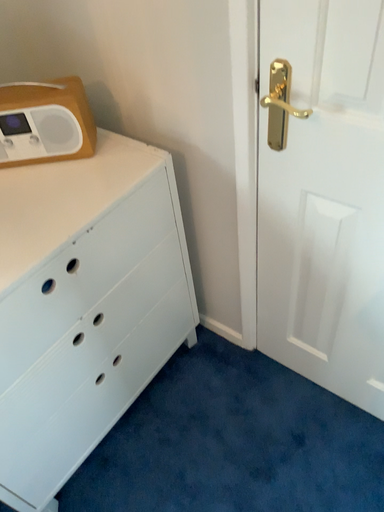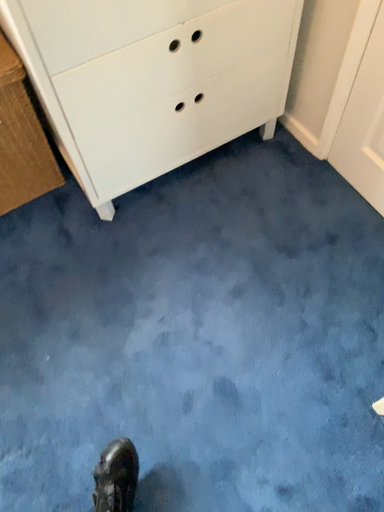
Question: Which way did the camera rotate in the video?

Choices:
 (A) rotated right
 (B) rotated left

Answer: (B)